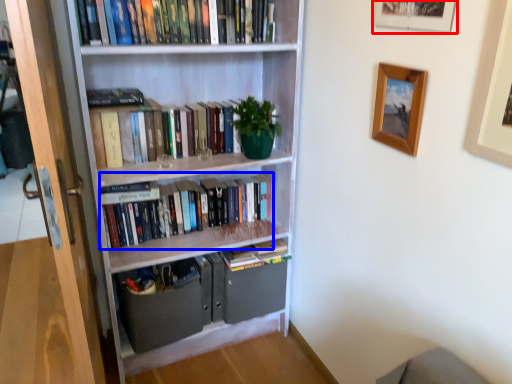
Question: Among these objects, which one is nearest to the camera, picture frame (highlighted by a red box) or book (highlighted by a blue box)?

Choices:
 (A) picture frame
 (B) book

Answer: (A)